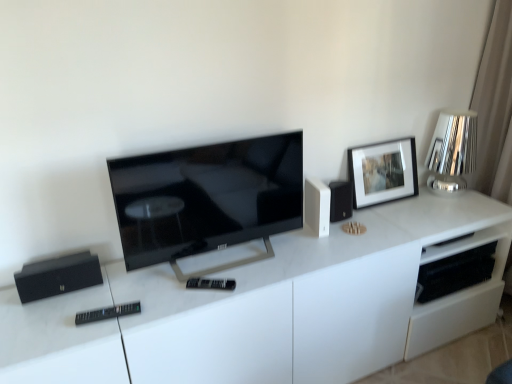
The height and width of the screenshot is (384, 512). Identify the location of vacant area that lies between black plastic remote at center, which appears as the 2th remote when ordered from the bottom, and shiny metallic lamp at upper right. (348, 238).